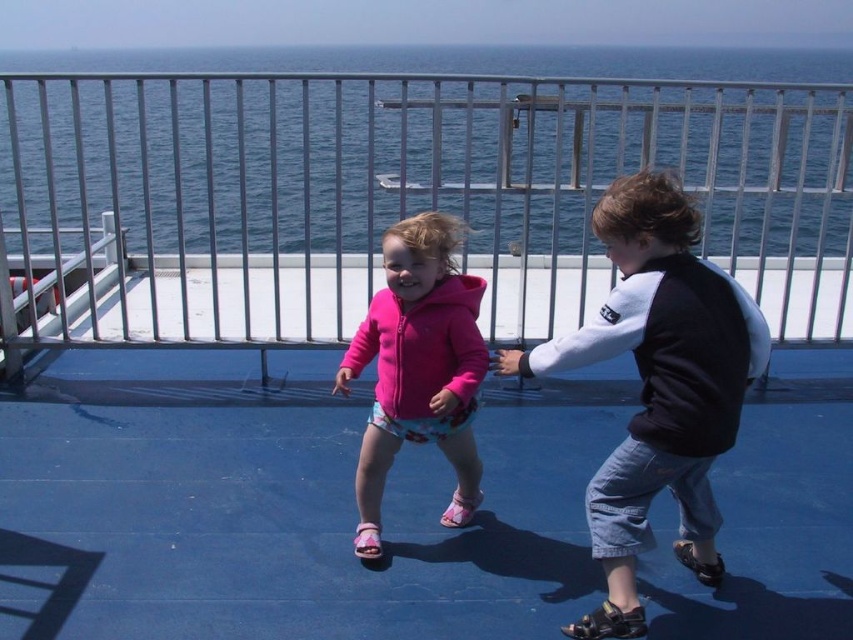
Does brushed metal rail at upper center have a greater height compared to pink fleece jacket at center?

Correct, brushed metal rail at upper center is much taller as pink fleece jacket at center.

Is brushed metal rail at upper center below pink fleece jacket at center?

No, brushed metal rail at upper center is not below pink fleece jacket at center.

Describe the element at coordinates (396, 196) in the screenshot. I see `brushed metal rail at upper center` at that location.

At what (x,y) coordinates should I click in order to perform the action: click on brushed metal rail at upper center. Please return your answer as a coordinate pair (x, y). Looking at the image, I should click on (396, 196).

Is brushed metal rail at upper center thinner than black and white sweater at right?

Incorrect, brushed metal rail at upper center's width is not less than black and white sweater at right's.

Does brushed metal rail at upper center have a greater height compared to black and white sweater at right?

Indeed, brushed metal rail at upper center has a greater height compared to black and white sweater at right.

Measure the distance between brushed metal rail at upper center and camera.

Result: brushed metal rail at upper center is 3.31 meters away from camera.

This screenshot has height=640, width=853. In order to click on brushed metal rail at upper center in this screenshot , I will do `click(396, 196)`.

Is black and white sweater at right positioned behind pink fleece jacket at center?

No, black and white sweater at right is in front of pink fleece jacket at center.

Does black and white sweater at right have a larger size compared to pink fleece jacket at center?

Correct, black and white sweater at right is larger in size than pink fleece jacket at center.

Is point (625, 220) less distant than point (421, 397)?

Yes, point (625, 220) is in front of point (421, 397).

Find the location of `black and white sweater at right`. black and white sweater at right is located at coordinates (657, 385).